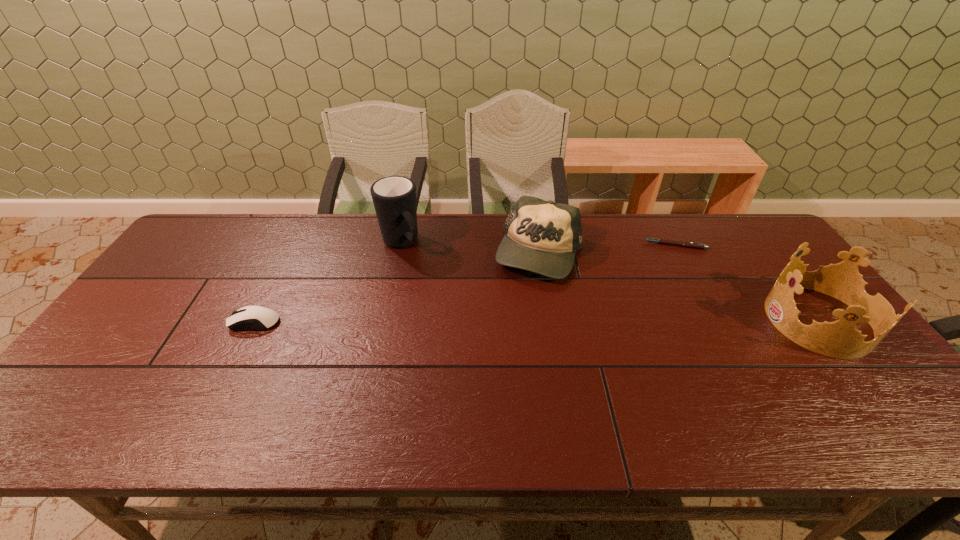
Image resolution: width=960 pixels, height=540 pixels. I want to click on vacant space positioned 0.200m on the side of the fourth object from right to left with the handle, so click(x=444, y=294).

This screenshot has height=540, width=960. Identify the location of pen located at the far edge. (663, 241).

Find the location of a particular element. Image resolution: width=960 pixels, height=540 pixels. baseball cap located in the far edge section of the desktop is located at coordinates [x=541, y=236].

Find the location of `mug that is at the far edge`. mug that is at the far edge is located at coordinates (394, 197).

The height and width of the screenshot is (540, 960). I want to click on object at the right edge, so pos(840,339).

In the image, there is a desktop. Identify the location of vacant space at the far edge. (348, 222).

Locate an element on the screen. Image resolution: width=960 pixels, height=540 pixels. vacant area at the near edge is located at coordinates (736, 399).

The image size is (960, 540). I want to click on free spot at the left edge of the desktop, so click(x=149, y=303).

Locate an element on the screen. This screenshot has height=540, width=960. vacant space at the far left corner of the desktop is located at coordinates (206, 240).

At what (x,y) coordinates should I click in order to perform the action: click on vacant space at the near left corner of the desktop. Please return your answer as a coordinate pair (x, y). Looking at the image, I should click on (83, 397).